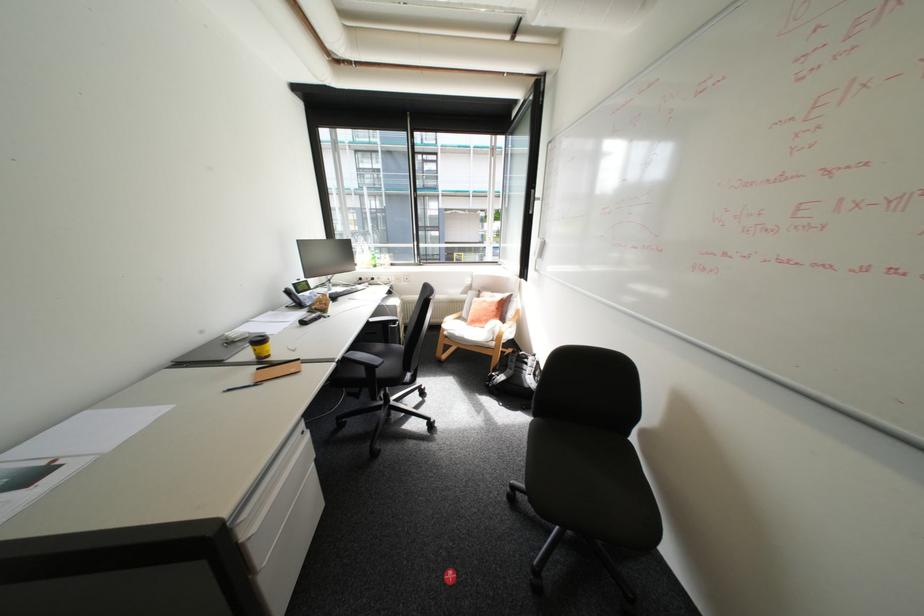
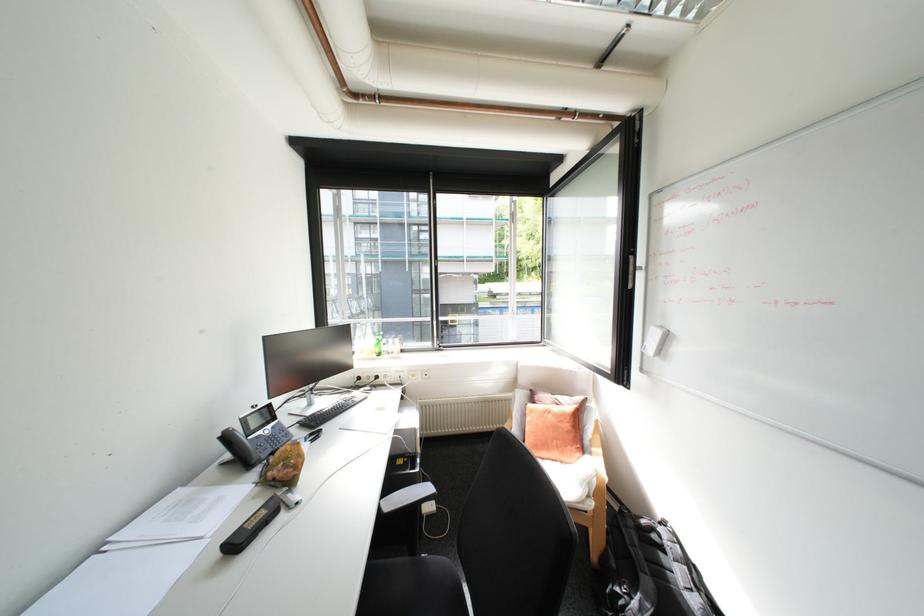
Locate, in the second image, the point that corresponds to [406,306] in the first image.

(424, 429)